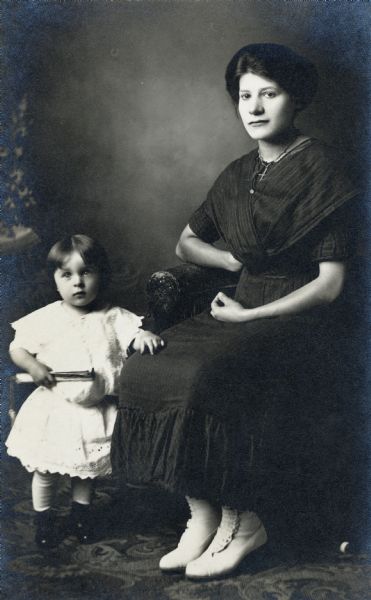
At what (x,y) coordinates should I click in order to perform the action: click on front of arm chair. Please return your answer as a coordinate pair (x, y). The image size is (371, 600). Looking at the image, I should click on (161, 285).